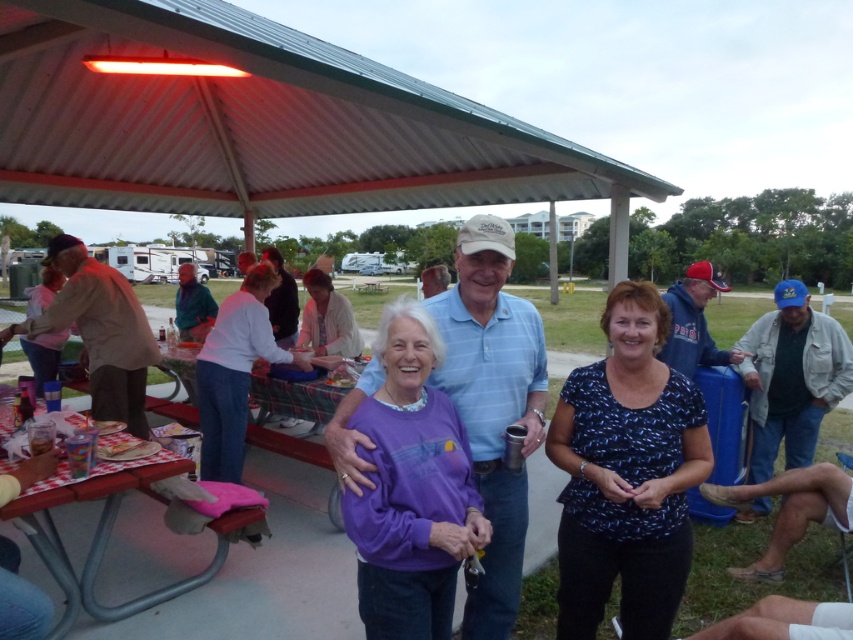
Who is shorter, purple fleece at center or red plastic table at lower left?

With less height is red plastic table at lower left.

Where is `purple fleece at center`? The height and width of the screenshot is (640, 853). purple fleece at center is located at coordinates (410, 490).

Is point (419, 397) less distant than point (105, 620)?

Yes.

This screenshot has height=640, width=853. In order to click on purple fleece at center in this screenshot , I will do `click(410, 490)`.

Looking at this image, which is more to the left, blue denim jacket at lower right or light brown cotton shirt at left?

Positioned to the left is light brown cotton shirt at left.

Does blue denim jacket at lower right have a greater width compared to light brown cotton shirt at left?

No.

The width and height of the screenshot is (853, 640). I want to click on blue denim jacket at lower right, so click(x=791, y=378).

In order to click on blue denim jacket at lower right in this screenshot , I will do `click(791, 378)`.

Who is shorter, blue printed blouse at center or light brown cotton shirt at left?

With less height is blue printed blouse at center.

Can you confirm if blue printed blouse at center is bigger than light brown cotton shirt at left?

No, blue printed blouse at center is not bigger than light brown cotton shirt at left.

The height and width of the screenshot is (640, 853). I want to click on blue printed blouse at center, so click(x=625, y=474).